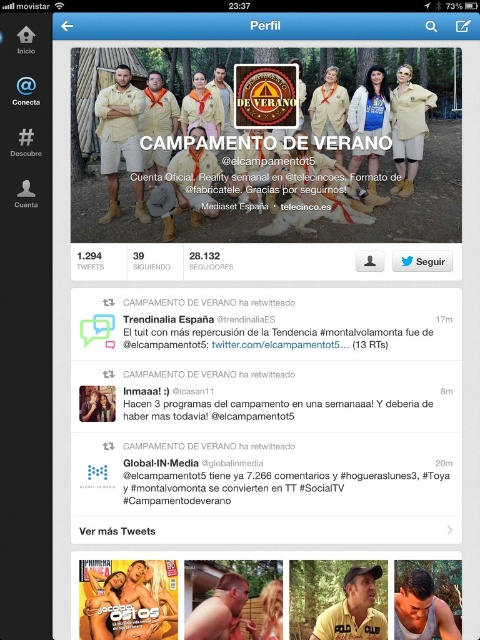
Can you confirm if matte khaki shirt at center is shorter than wooden fence at center?

Incorrect, matte khaki shirt at center's height does not fall short of wooden fence at center's.

Locate an element on the screen. This screenshot has width=480, height=640. matte khaki shirt at center is located at coordinates (201, 108).

Which is behind, point (180, 118) or point (254, 636)?

Positioned behind is point (180, 118).

Locate an element on the screen. The image size is (480, 640). matte khaki shirt at center is located at coordinates (201, 108).

Between muscular tan torso at center and wooden fence at center, which one has more height?

muscular tan torso at center

What do you see at coordinates (421, 609) in the screenshot? I see `muscular tan torso at center` at bounding box center [421, 609].

Where is `muscular tan torso at center`? muscular tan torso at center is located at coordinates (421, 609).

Between point (397, 180) and point (272, 625), which one is positioned in front?

Point (272, 625) is in front.

Between light beige fabric shirt at upper right and wooden fence at center, which one is positioned lower?

wooden fence at center is below.

Where is `light beige fabric shirt at upper right`? light beige fabric shirt at upper right is located at coordinates (408, 128).